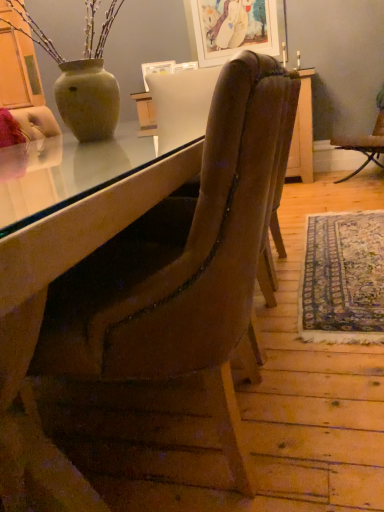
Question: Does velvet brown chair at center, which appears as the first chair when ordered from the bottom, touch matte white picture frame at upper center?

Choices:
 (A) no
 (B) yes

Answer: (A)

Question: Is velvet brown chair at center, positioned as the second chair in right-to-left order, shorter than matte white picture frame at upper center?

Choices:
 (A) yes
 (B) no

Answer: (B)

Question: Is velvet brown chair at center, which is the first chair in left-to-right order, to the left of matte white picture frame at upper center from the viewer's perspective?

Choices:
 (A) no
 (B) yes

Answer: (B)

Question: Does velvet brown chair at center, positioned as the second chair in right-to-left order, lie behind matte white picture frame at upper center?

Choices:
 (A) yes
 (B) no

Answer: (B)

Question: Can you confirm if velvet brown chair at center, which ranks as the first chair in front-to-back order, is taller than matte white picture frame at upper center?

Choices:
 (A) yes
 (B) no

Answer: (A)

Question: Considering their positions, is velvet brown chair at center, which appears as the first chair when ordered from the bottom, located in front of or behind brown leather chair at right, arranged as the second chair when ordered from the bottom?

Choices:
 (A) behind
 (B) front

Answer: (B)

Question: From the image's perspective, relative to brown leather chair at right, arranged as the second chair when ordered from the bottom, is velvet brown chair at center, positioned as the second chair in right-to-left order, above or below?

Choices:
 (A) above
 (B) below

Answer: (B)

Question: Considering the positions of point (130, 310) and point (379, 138), is point (130, 310) closer or farther from the camera than point (379, 138)?

Choices:
 (A) farther
 (B) closer

Answer: (B)

Question: From a real-world perspective, is velvet brown chair at center, marked as the second chair in a back-to-front arrangement, above or below brown leather chair at right, arranged as the 1th chair when viewed from the top?

Choices:
 (A) below
 (B) above

Answer: (B)

Question: Would you say blue patterned rug at lower right is inside or outside brown leather chair at right, the second chair viewed from the left?

Choices:
 (A) inside
 (B) outside

Answer: (B)

Question: From a real-world perspective, is blue patterned rug at lower right physically located above or below brown leather chair at right, the second chair viewed from the front?

Choices:
 (A) above
 (B) below

Answer: (B)

Question: Is point (319, 288) positioned closer to the camera than point (382, 110)?

Choices:
 (A) farther
 (B) closer

Answer: (B)

Question: Is blue patterned rug at lower right wider or thinner than brown leather chair at right, the 1th chair in the back-to-front sequence?

Choices:
 (A) thin
 (B) wide

Answer: (A)

Question: From a real-world perspective, is blue patterned rug at lower right above or below velvet brown chair at center, which is the 2th chair from top to bottom?

Choices:
 (A) below
 (B) above

Answer: (A)

Question: Considering the positions of blue patterned rug at lower right and velvet brown chair at center, which is the 2th chair from top to bottom, in the image, is blue patterned rug at lower right taller or shorter than velvet brown chair at center, which is the 2th chair from top to bottom,?

Choices:
 (A) short
 (B) tall

Answer: (A)